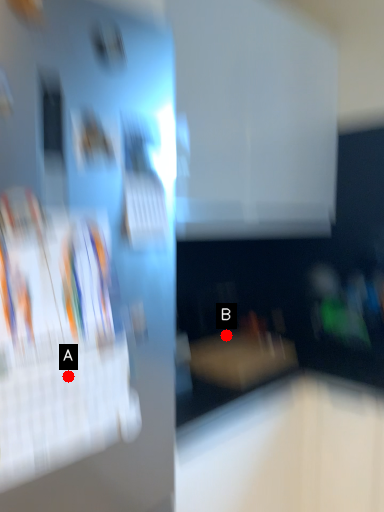
Question: Two points are circled on the image, labeled by A and B beside each circle. Which of the following is the farthest from the observer?

Choices:
 (A) A is further
 (B) B is further

Answer: (B)